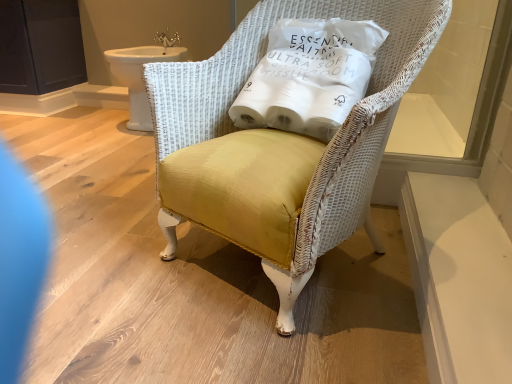
Find the location of a particular element. This screenshot has height=384, width=512. vacant area situated below white wicker chair at center (from a real-world perspective) is located at coordinates (307, 284).